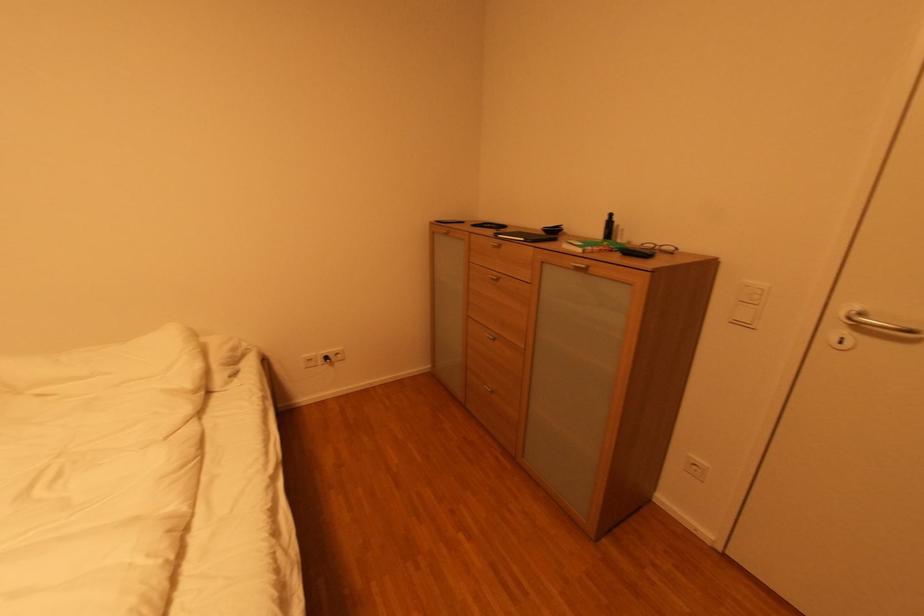
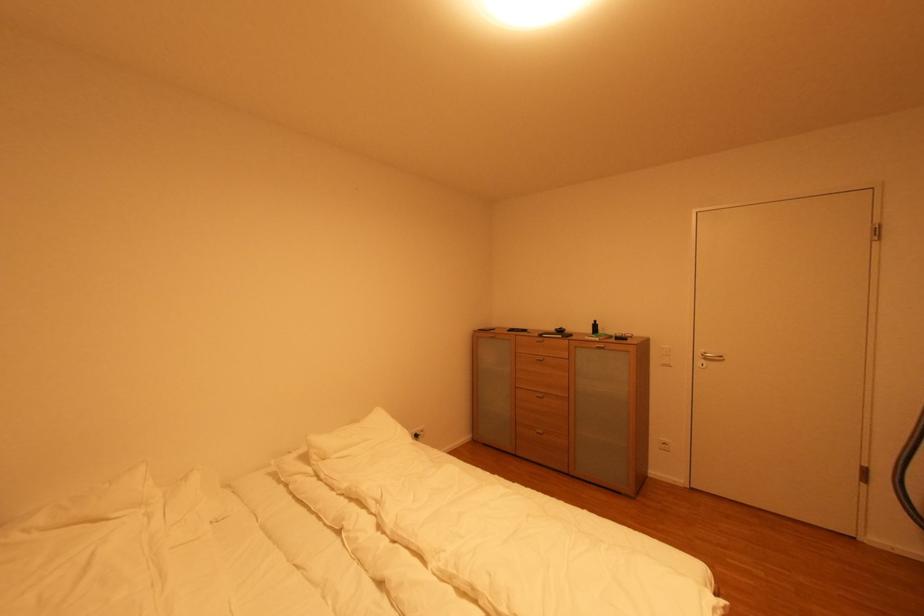
In the second image, find the point that corresponds to point 30,394 in the first image.

(330, 461)